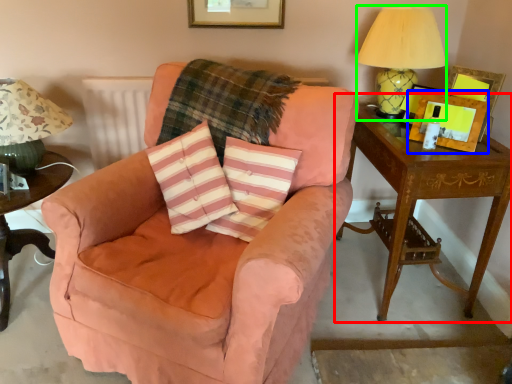
Question: Which object is positioned farthest from table (highlighted by a red box)? Select from picture frame (highlighted by a blue box) and table lamp (highlighted by a green box).

Choices:
 (A) picture frame
 (B) table lamp

Answer: (B)